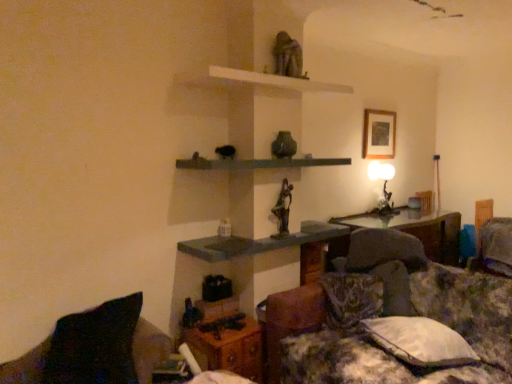
Question: From a real-world perspective, is fluffy fabric pillow at lower right, the 1th pillow viewed from the right, positioned above or below green concrete shelf at center, marked as the second shelf in a bottom-to-top arrangement?

Choices:
 (A) below
 (B) above

Answer: (A)

Question: Is fluffy fabric pillow at lower right, arranged as the 1th pillow when viewed from the back, to the left or to the right of green concrete shelf at center, the second shelf when ordered from top to bottom, in the image?

Choices:
 (A) right
 (B) left

Answer: (A)

Question: Considering the real-world distances, which object is closest to the matte gray shelf at center, the 3th shelf when ordered from top to bottom?

Choices:
 (A) matte black table lamp at upper right
 (B) wooden picture frame at upper center
 (C) matte gray stone statue at upper center, which appears as the second sculpture when ordered from the bottom
 (D) black fabric pillow at lower left, which is the third pillow in back-to-front order
 (E) fluffy fabric pillow at lower right, arranged as the 1th pillow when viewed from the back

Answer: (D)

Question: Estimate the real-world distances between objects in this image. Which object is farther from the bronze statue at center, positioned as the 1th sculpture in bottom-to-top order?

Choices:
 (A) fluffy fabric couch at lower right
 (B) white fabric pillow at lower right, the second pillow positioned from the front
 (C) green concrete shelf at center, the second shelf when ordered from top to bottom
 (D) black fabric pillow at lower left, which is the third pillow in back-to-front order
 (E) matte gray shelf at center, the 3th shelf when ordered from top to bottom

Answer: (D)